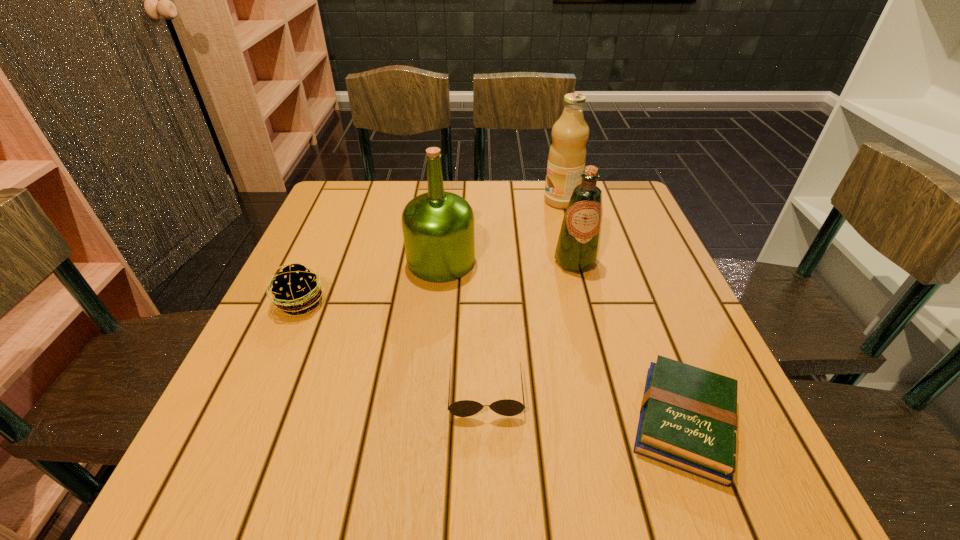
Where is `vacant area between the sunglasses and the leftmost olive oil`? vacant area between the sunglasses and the leftmost olive oil is located at coordinates (464, 327).

Image resolution: width=960 pixels, height=540 pixels. What are the coordinates of `empty space between the book and the leftmost olive oil` in the screenshot? It's located at tap(563, 341).

Identify the location of free space between the farthest olive oil and the sunglasses. This screenshot has width=960, height=540. (523, 297).

You are a GUI agent. You are given a task and a screenshot of the screen. Output one action in this format:
    pyautogui.click(x=<x>, y=<y>)
    Task: Click on the empty location between the leftmost olive oil and the third tallest object
    
    Given the screenshot: What is the action you would take?
    pyautogui.click(x=508, y=261)

This screenshot has height=540, width=960. In order to click on free area in between the sunglasses and the shortest olive oil in this screenshot , I will do `click(531, 327)`.

The height and width of the screenshot is (540, 960). Identify the location of the third closest object to the sunglasses. (577, 249).

At what (x,y) coordinates should I click in order to perform the action: click on object that is the nearest to the book. Please return your answer as a coordinate pair (x, y). The image size is (960, 540). Looking at the image, I should click on point(506,407).

Select which olive oil is the closest to the shortest olive oil. Please provide its 2D coordinates. Your answer should be formatted as a tuple, i.e. [(x, y)], where the tuple contains the x and y coordinates of a point satisfying the conditions above.

[(567, 155)]

I want to click on the third closest olive oil relative to the book, so click(567, 155).

Where is `vacant point that satisfies the following two spatial constraints: 1. on the label of the farthest object; 2. on the front-facing side of the sunglasses`? The image size is (960, 540). vacant point that satisfies the following two spatial constraints: 1. on the label of the farthest object; 2. on the front-facing side of the sunglasses is located at coordinates (612, 393).